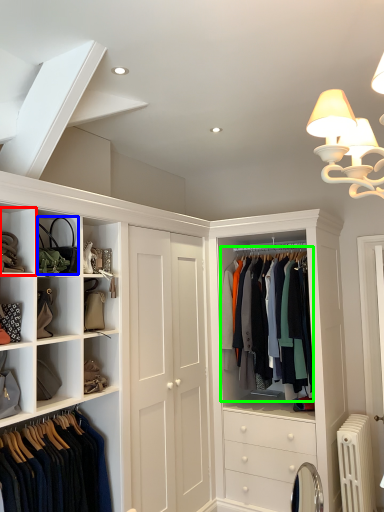
Question: Which object is positioned closest to cabinet (highlighted by a red box)? Select from accessory (highlighted by a blue box) and clothing (highlighted by a green box).

Choices:
 (A) accessory
 (B) clothing

Answer: (A)